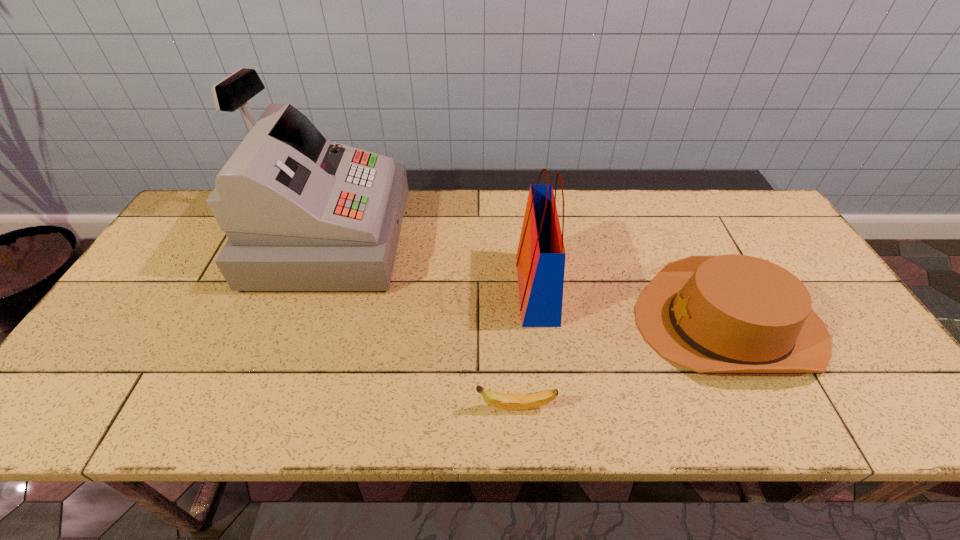
Where is `free region located 0.160m on the front-facing side of the rightmost object`? The height and width of the screenshot is (540, 960). free region located 0.160m on the front-facing side of the rightmost object is located at coordinates (571, 323).

This screenshot has width=960, height=540. I want to click on vacant space located on the front-facing side of the rightmost object, so click(x=564, y=323).

The width and height of the screenshot is (960, 540). I want to click on free space located on the front-facing side of the rightmost object, so click(x=523, y=323).

This screenshot has height=540, width=960. Identify the location of free point located at the stem of the banana. (392, 407).

Find the location of a particular element. This screenshot has width=960, height=540. free space located 0.240m at the stem of the banana is located at coordinates (363, 407).

The height and width of the screenshot is (540, 960). Find the location of `vacant region located at the stem of the banana`. vacant region located at the stem of the banana is located at coordinates (387, 407).

Identify the location of object situated at the far edge. This screenshot has height=540, width=960. (302, 213).

Find the location of a particular element. The image size is (960, 540). object at the near edge is located at coordinates (504, 401).

At what (x,y) coordinates should I click in order to perform the action: click on object situated at the right edge. Please return your answer as a coordinate pair (x, y). Image resolution: width=960 pixels, height=540 pixels. Looking at the image, I should click on (732, 313).

Identify the location of vacant space at the far edge. (516, 233).